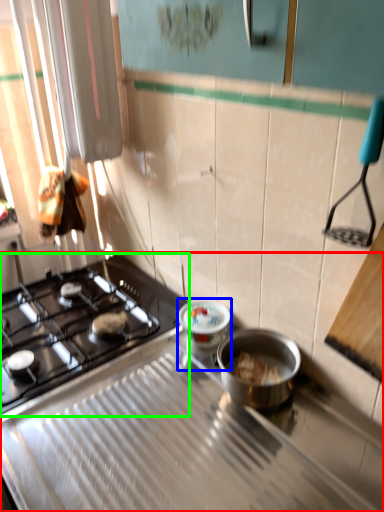
Question: Which object is positioned closest to gas stove (highlighted by a red box)? Select from appliance (highlighted by a blue box) and gas stove (highlighted by a green box).

Choices:
 (A) appliance
 (B) gas stove

Answer: (B)